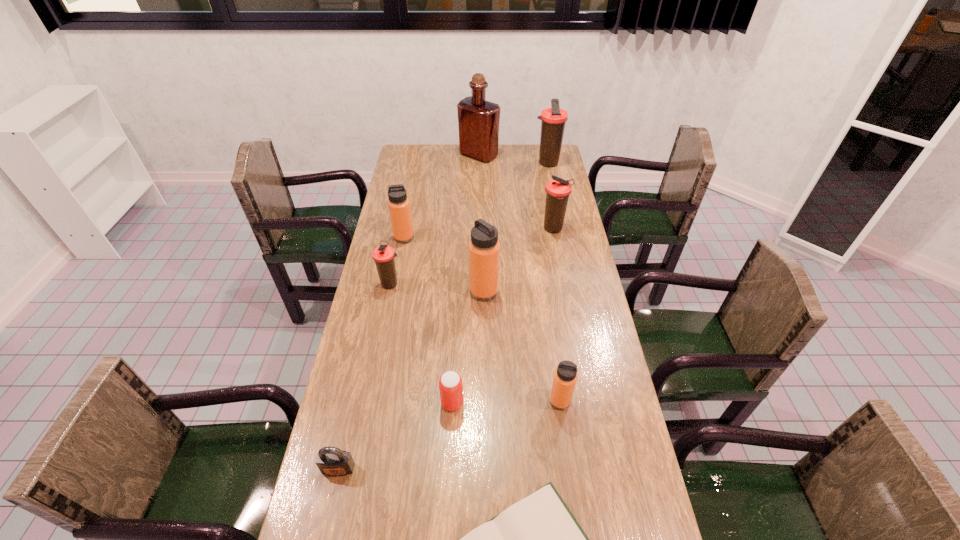
I want to click on brown liquor, so click(478, 120).

Locate an element on the screen. Image resolution: width=960 pixels, height=540 pixels. the tallest object is located at coordinates (478, 120).

Find the location of a particular element. the farthest thermos bottle is located at coordinates (553, 119).

You are a GUI agent. You are given a task and a screenshot of the screen. Output one action in this format:
    pyautogui.click(x=<x>, y=<y>)
    Task: Click on the biggest brown thermos bottle
    The height and width of the screenshot is (540, 960).
    Given the screenshot: What is the action you would take?
    pyautogui.click(x=553, y=119)

Find the location of a particular element. This screenshot has width=960, height=540. the second farthest orange thermos bottle is located at coordinates (484, 248).

The image size is (960, 540). What are the coordinates of `the second orange thermos bottle from left to right` in the screenshot? It's located at (484, 248).

The width and height of the screenshot is (960, 540). I want to click on the second nearest brown thermos bottle, so click(558, 190).

The width and height of the screenshot is (960, 540). Identify the location of the farthest orange thermos bottle. (399, 207).

I want to click on the second smallest orange thermos bottle, so click(x=399, y=207).

Locate an element on the screen. Image resolution: width=960 pixels, height=540 pixels. the leftmost brown thermos bottle is located at coordinates (383, 255).